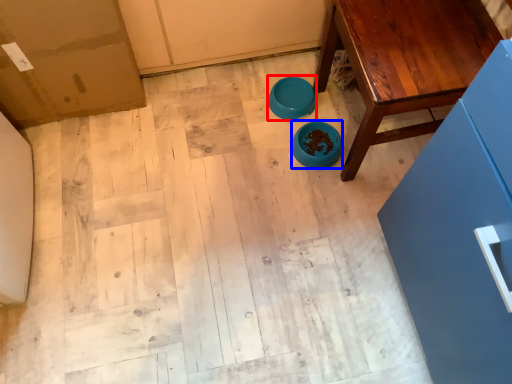
Question: Which point is closer to the camera, bowl (highlighted by a red box) or bowl (highlighted by a blue box)?

Choices:
 (A) bowl
 (B) bowl

Answer: (B)